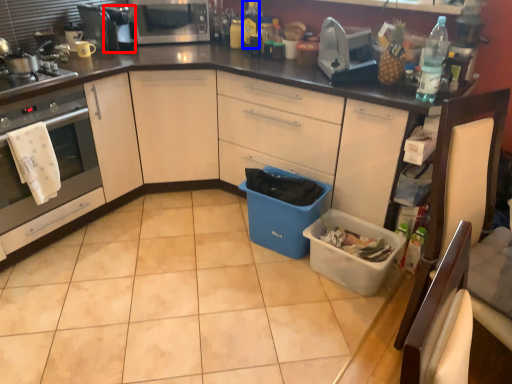
Question: Which of the following is the farthest to the observer, appliance (highlighted by a red box) or bottle (highlighted by a blue box)?

Choices:
 (A) appliance
 (B) bottle

Answer: (B)